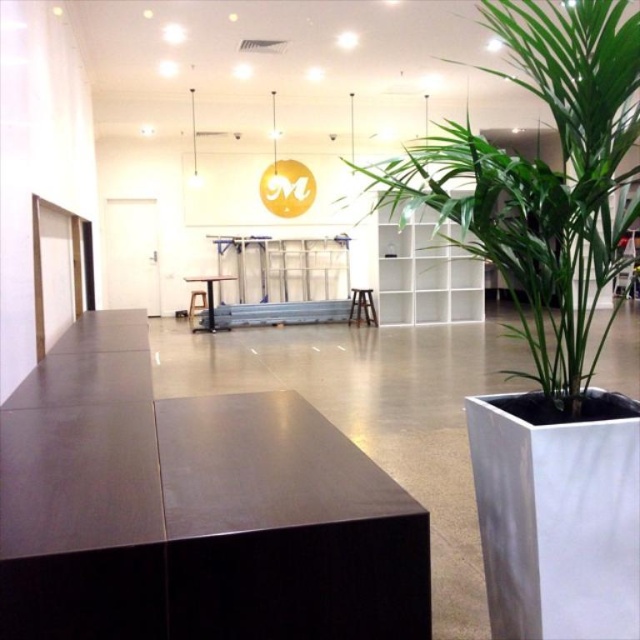
You are organizing a small event in this office space and need to place a banner between the green leafy plant at right and the matte black table at center. Based on their positions, where should the banner be hung?

The green leafy plant at right is located above the matte black table at center, so the banner should be hung above the matte black table at center to be between them.

You are organizing a small event in this office space and need to place a large banner between the green leafy plant at right and the matte black table at center. Which object should the banner be closer to if you want it to be more noticeable?

The green leafy plant at right is larger than the matte black table at center, so placing the banner closer to the green leafy plant at right would make it more noticeable due to the plant being a more prominent visual anchor in the space.

Consider the image. You are organizing a small event in this office space and need to place a 1.2 meter wide banner between the green leafy plant at right and the matte black table at center. Based on their widths, will the banner fit without overlapping either object?

The green leafy plant at right might be wider than the matte black table at center, so the banner may not fit properly if the plant is wider than 1.2 meters. Check the actual width of the plant to confirm.